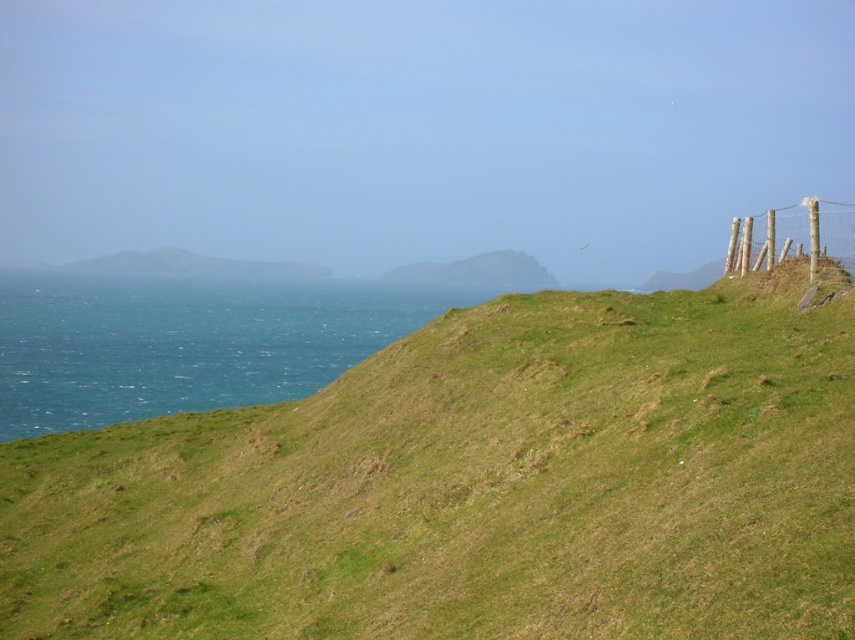
Consider the image. Is green grassy hillside at upper right positioned at the back of wooden post fence at upper right?

No, it is not.

Is green grassy hillside at upper right shorter than wooden post fence at upper right?

Correct, green grassy hillside at upper right is not as tall as wooden post fence at upper right.

Between point (45, 572) and point (846, 241), which one is positioned in front?

Point (45, 572) is in front.

What are the coordinates of `green grassy hillside at upper right` in the screenshot? It's located at (475, 486).

Is green grassy hillside at upper right taller than blue water at left?

In fact, green grassy hillside at upper right may be shorter than blue water at left.

Which is in front, point (659, 458) or point (195, 328)?

Point (659, 458) is in front.

Find the location of a particular element. The image size is (855, 640). green grassy hillside at upper right is located at coordinates (475, 486).

Can you confirm if blue water at left is shorter than wooden post fence at upper right?

Correct, blue water at left is not as tall as wooden post fence at upper right.

Image resolution: width=855 pixels, height=640 pixels. Describe the element at coordinates (186, 342) in the screenshot. I see `blue water at left` at that location.

Find the location of a particular element. blue water at left is located at coordinates click(186, 342).